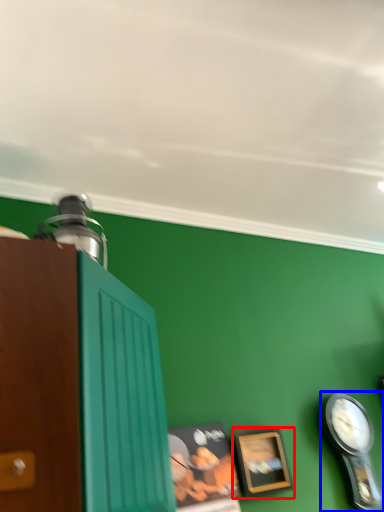
Question: Which object appears farthest to the camera in this image, picture frame (highlighted by a red box) or clock (highlighted by a blue box)?

Choices:
 (A) picture frame
 (B) clock

Answer: (B)